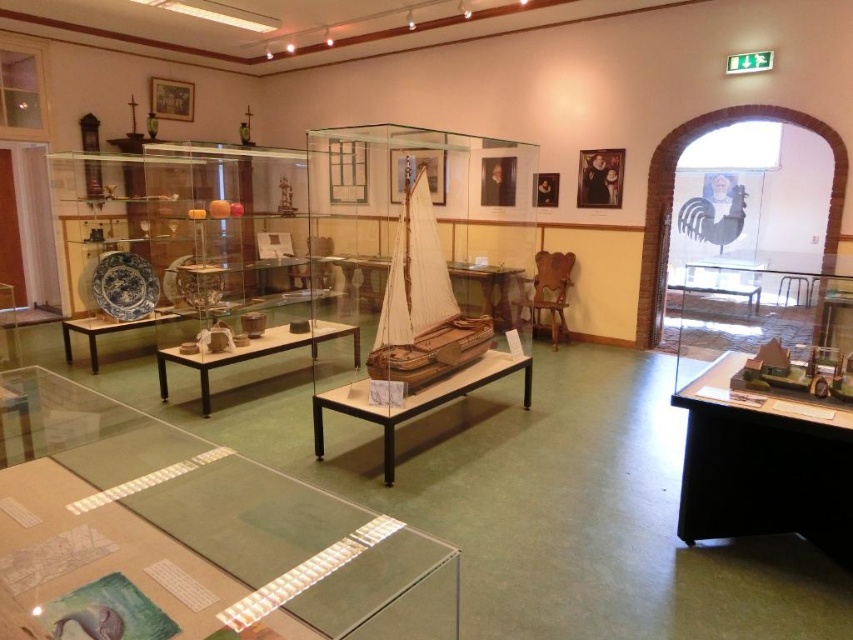
Which is above, black plastic table at lower right or wooden table at center?

wooden table at center is above.

Is point (712, 422) behind point (296, 336)?

No, (712, 422) is closer to viewer.

Locate an element on the screen. black plastic table at lower right is located at coordinates (763, 464).

Is transparent glass table at lower left positioned at the back of black plastic table at lower right?

No, transparent glass table at lower left is in front of black plastic table at lower right.

Is transparent glass table at lower left smaller than black plastic table at lower right?

Incorrect, transparent glass table at lower left is not smaller in size than black plastic table at lower right.

Which is behind, point (195, 442) or point (718, 532)?

Point (718, 532)

This screenshot has height=640, width=853. Identify the location of transparent glass table at lower left. (193, 536).

Is point (447, 305) less distant than point (489, 358)?

Yes, it is.

Is point (410, 209) in front of point (456, 376)?

Yes, point (410, 209) is closer to viewer.

You are a GUI agent. You are given a task and a screenshot of the screen. Output one action in this format:
    pyautogui.click(x=<x>, y=<y>)
    Task: Click on the wooden sailboat at center
    The width and height of the screenshot is (853, 640).
    Given the screenshot: What is the action you would take?
    pyautogui.click(x=422, y=305)